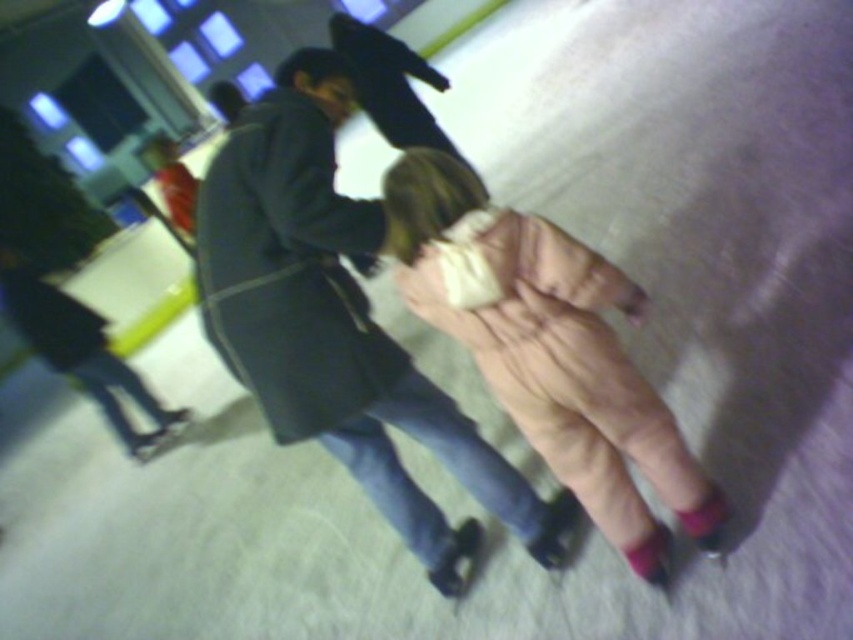
Is dark gray coat at center shorter than pink fuzzy coat at center?

No.

Who is shorter, dark gray coat at center or pink fuzzy coat at center?

With less height is pink fuzzy coat at center.

Between point (254, 189) and point (540, 288), which one is positioned behind?

Point (254, 189)

This screenshot has width=853, height=640. In order to click on dark gray coat at center in this screenshot , I will do `click(337, 323)`.